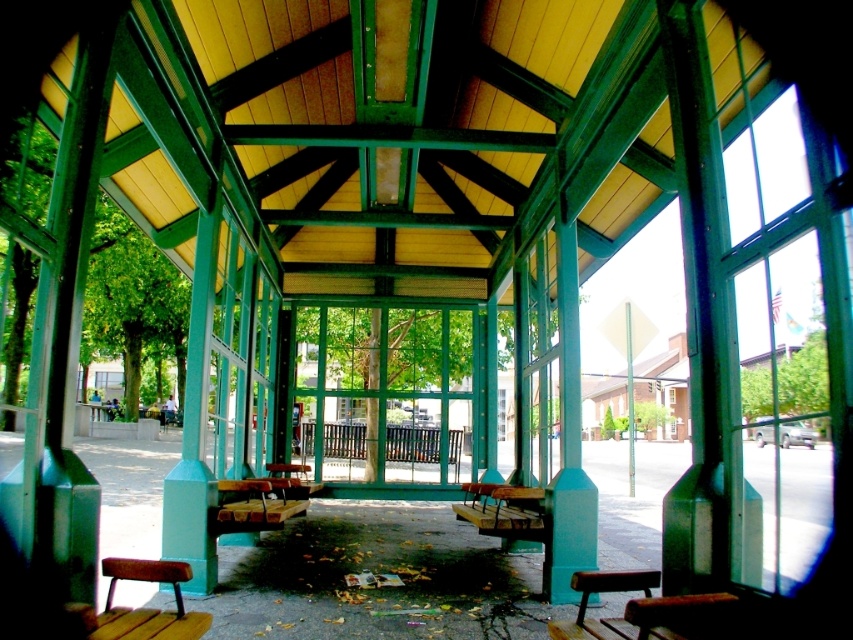
You are standing at the camera position and want to reach the clear glass window at right to take a photo through it. Is the distance between you and the window sufficient to allow you to take a clear photo without moving too close?

The distance between you and the clear glass window at right is 2.22 meters, which is sufficient to take a clear photo without needing to move closer.

Consider the image. You are standing in the covered outdoor seating area and want to place a small potted plant between the two points marked as point (582, 621) and point (183, 632). Will the plant be closer to the front or the back of the seating area?

The plant will be closer to the front of the seating area because point (582, 621) is further to the viewer than point (183, 632), so placing the plant between them would position it nearer to the front where the closer point is located.

You are a visitor sitting on the wooden bench at lower right and want to look outside through the clear glass window at right. Can you see the window from your current position?

The clear glass window at right is positioned on the right side of the wooden bench at lower right, so yes, you can see the window from your current position on the wooden bench at lower right.